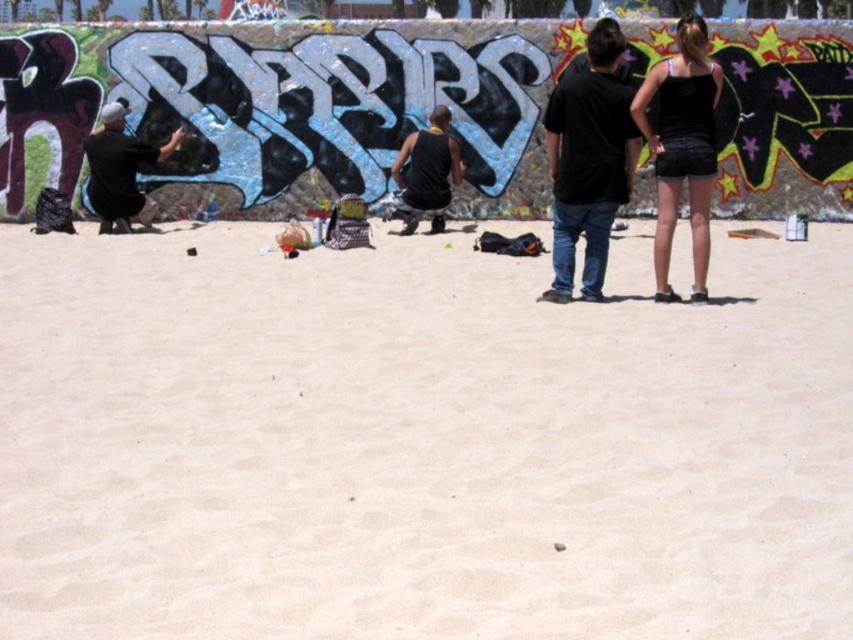
Is beige sand at lower center positioned in front of black leather shorts at upper right?

That is True.

Who is higher up, beige sand at lower center or black leather shorts at upper right?

black leather shorts at upper right is higher up.

At what (x,y) coordinates should I click in order to perform the action: click on beige sand at lower center. Please return your answer as a coordinate pair (x, y). The image size is (853, 640). Looking at the image, I should click on (419, 442).

Does black matte shirt at center have a greater height compared to black leather shorts at upper right?

Yes, black matte shirt at center is taller than black leather shorts at upper right.

In the scene shown: Who is taller, black matte shirt at center or black leather shorts at upper right?

Standing taller between the two is black matte shirt at center.

Find the location of a particular element. black matte shirt at center is located at coordinates (589, 161).

The width and height of the screenshot is (853, 640). What are the coordinates of `black matte shirt at center` in the screenshot? It's located at (589, 161).

Between black leather shorts at upper right and black tank top at center, which one appears on the right side from the viewer's perspective?

From the viewer's perspective, black leather shorts at upper right appears more on the right side.

Is point (693, 236) in front of point (426, 154)?

Yes, point (693, 236) is in front of point (426, 154).

Where is `black leather shorts at upper right`? Image resolution: width=853 pixels, height=640 pixels. black leather shorts at upper right is located at coordinates [682, 147].